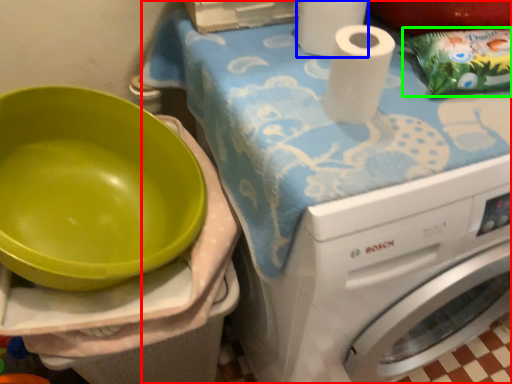
Question: Which is nearer to the machine (highlighted by a red box)? paper towel (highlighted by a blue box) or waste (highlighted by a green box).

Choices:
 (A) paper towel
 (B) waste

Answer: (B)